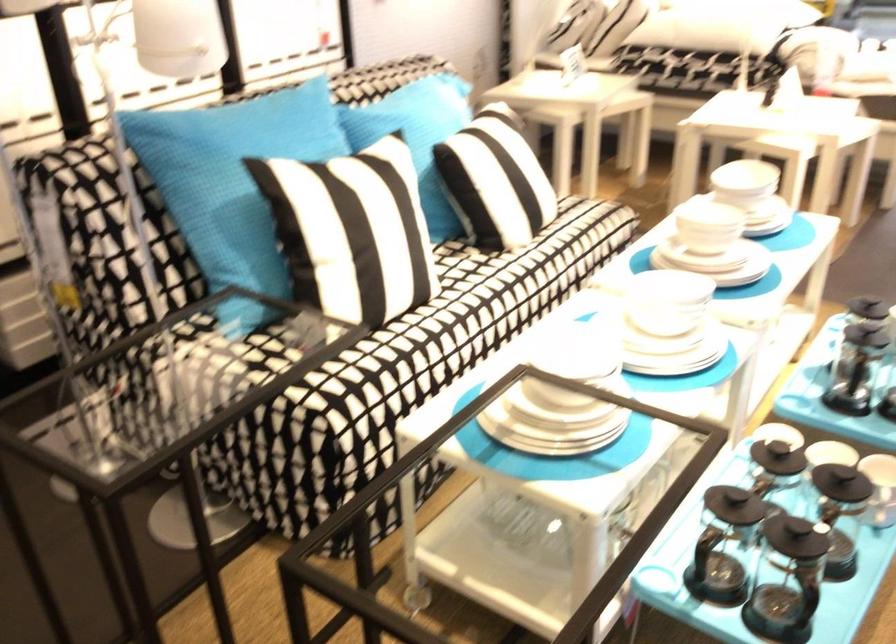
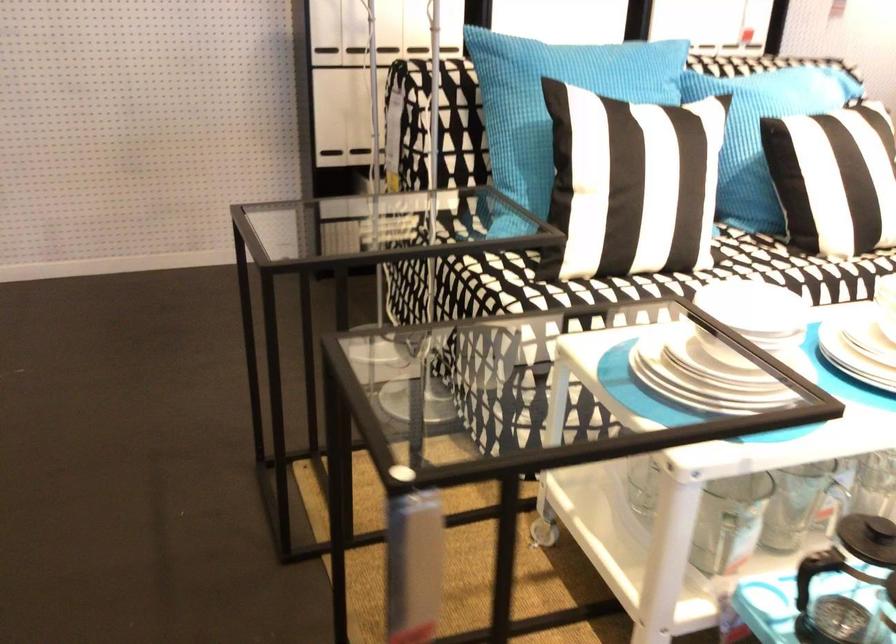
In the second image, find the point that corresponds to pixel 566 346 in the first image.

(757, 310)